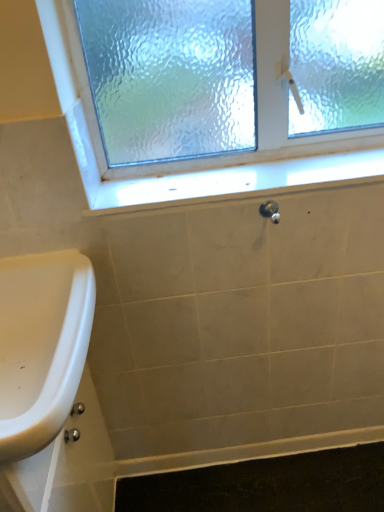
Question: Is satin nickel knob at center bigger or smaller than frosted glass window at upper center?

Choices:
 (A) small
 (B) big

Answer: (A)

Question: In terms of height, does satin nickel knob at center look taller or shorter compared to frosted glass window at upper center?

Choices:
 (A) short
 (B) tall

Answer: (A)

Question: Estimate the real-world distances between objects in this image. Which object is closer to the white glossy window sill at center?

Choices:
 (A) satin nickel knob at center
 (B) frosted glass window at upper center
 (C) black rubber bath mat at lower center
 (D) white glossy sink at lower left

Answer: (B)

Question: Which object is the farthest from the satin nickel knob at center?

Choices:
 (A) white glossy sink at lower left
 (B) white glossy window sill at center
 (C) frosted glass window at upper center
 (D) black rubber bath mat at lower center

Answer: (D)